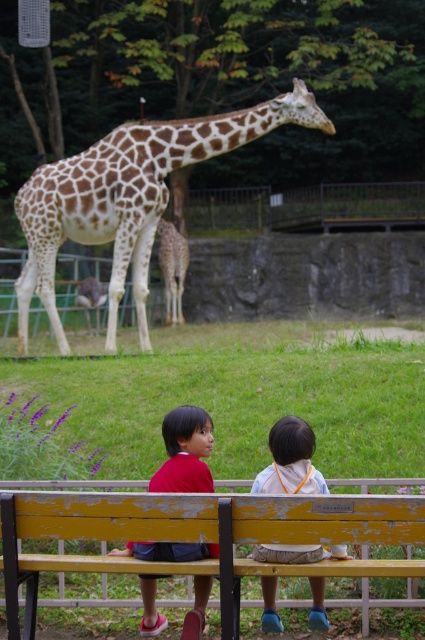
You are a parent trying to ensure your child can see the giraffe over the wooden bench at center. Given that the red fabric shirt at center is worn by your child, can the child see over the bench?

The wooden bench at center is taller than the red fabric shirt at center, so the child wearing the red fabric shirt at center cannot see over the bench.

Where is the red fabric shirt at center located in the image?

The red fabric shirt at center is located at point (184, 451) in the image.

You are a zookeeper observing two children sitting on a bench. The children are wearing a red fabric shirt at center and a light blue fabric shirt at center. Which child is shorter?

The red fabric shirt at center has a lesser height compared to light blue fabric shirt at center, so the child wearing the red fabric shirt at center is shorter.